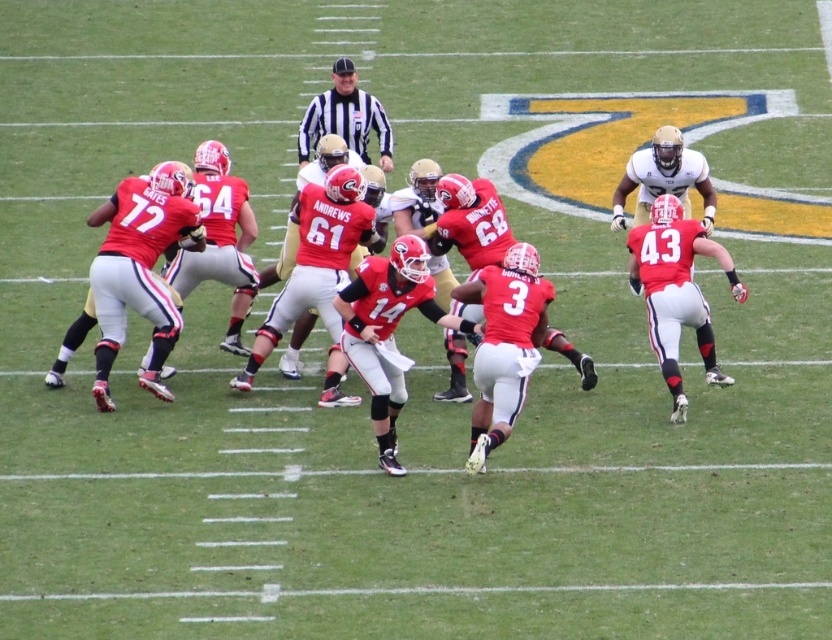
In the scene shown: You are a sports analyst watching the game. You notice two players wearing matte red jerseys at center and at right. Which player, the matte red jersey at center or the matte red jersey at right, appears to be wearing a wider jersey?

The matte red jersey at center appears to be wearing a wider jersey since its width is larger than the matte red jersey at right.

Looking at this image, you are a spectator sitting in the stands watching the American football game. You want to throw a small beanbag to hit the point at coordinates (667, 273) on the field. If your beanbag can travel up to 12 meters, will it reach the point?

The point at coordinates (667, 273) is 11.41 meters away from the viewer. Since the beanbag can travel up to 12 meters, it will reach the point.